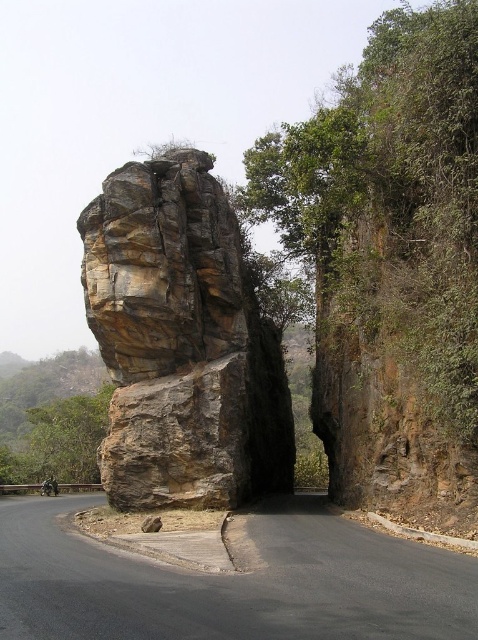
Between rustic stone rock at center and green leafy tree at left, which one is positioned higher?

rustic stone rock at center is above.

Can you confirm if rustic stone rock at center is bigger than green leafy tree at left?

No.

Which is behind, point (232, 276) or point (14, 381)?

Point (14, 381)

You are a GUI agent. You are given a task and a screenshot of the screen. Output one action in this format:
    pyautogui.click(x=<x>, y=<y>)
    Task: Click on the rustic stone rock at center
    Image resolution: width=478 pixels, height=640 pixels.
    Given the screenshot: What is the action you would take?
    pyautogui.click(x=182, y=342)

Does asphalt road at center appear under green leafy tree at left?

Incorrect, asphalt road at center is not positioned below green leafy tree at left.

From the picture: Who is higher up, asphalt road at center or green leafy tree at left?

asphalt road at center

Is point (465, 604) in front of point (40, 396)?

Yes, it is in front of point (40, 396).

This screenshot has height=640, width=478. Find the location of `asphalt road at center`. asphalt road at center is located at coordinates (231, 582).

Does rustic stone rock at center appear on the right side of asphalt road at center?

No, rustic stone rock at center is not to the right of asphalt road at center.

Can you confirm if rustic stone rock at center is positioned above asphalt road at center?

Yes.

Is point (216, 362) farther from viewer compared to point (251, 588)?

Yes, point (216, 362) is behind point (251, 588).

The height and width of the screenshot is (640, 478). In order to click on rustic stone rock at center in this screenshot , I will do `click(182, 342)`.